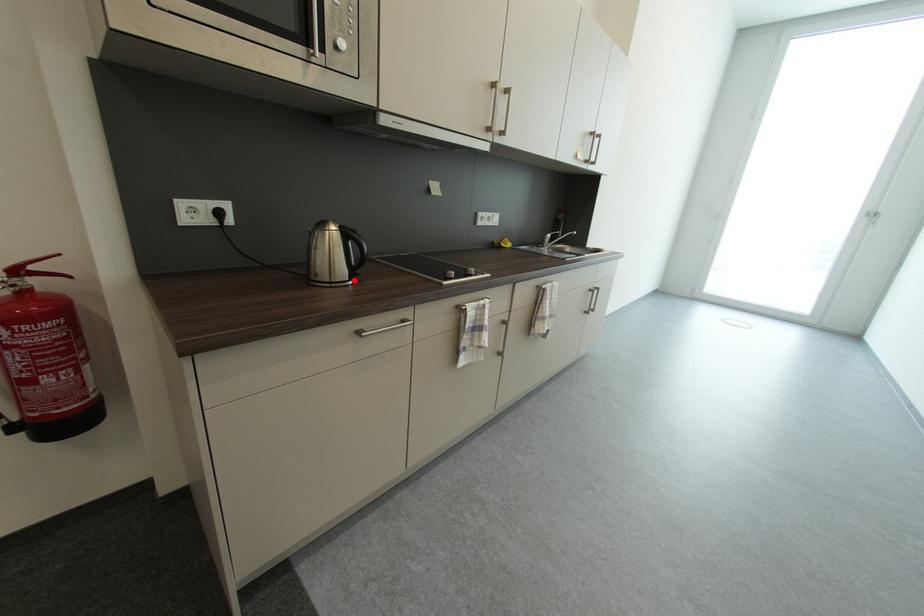
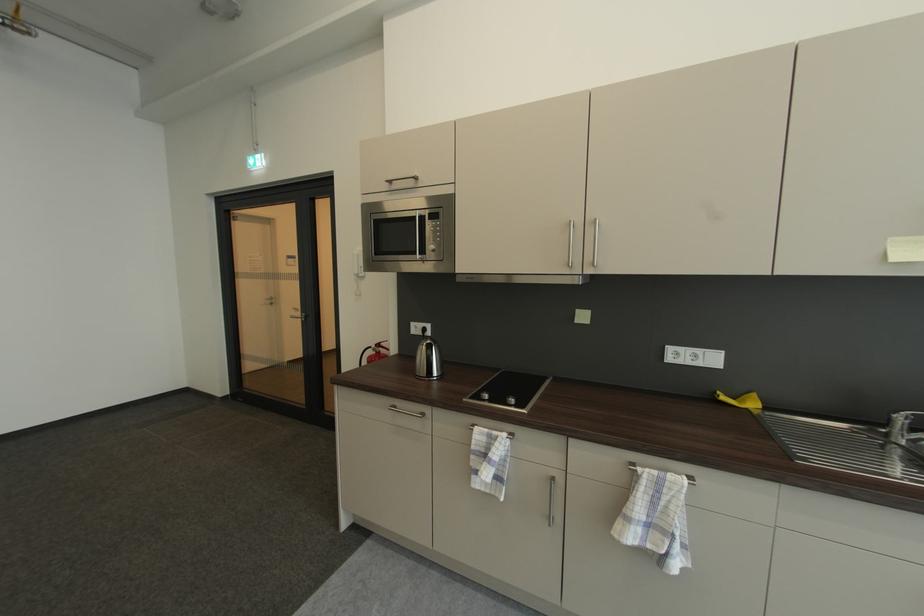
Question: I am providing you with two images of the same scene from different viewpoints. Image1 has a red point marked. In image2, the corresponding 3D location appears at what relative position? Reply with the corresponding letter.

Choices:
 (A) Closer
 (B) Farther

Answer: (B)